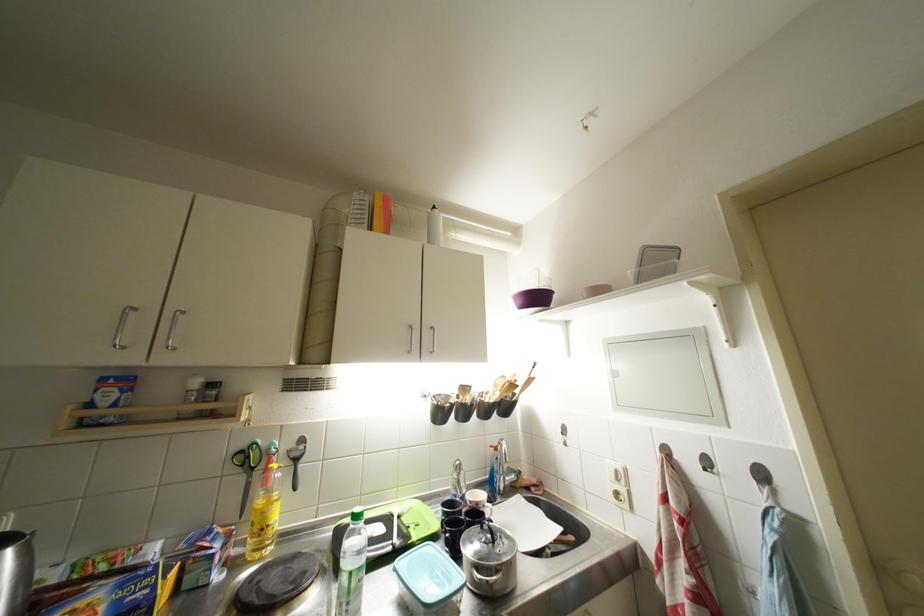
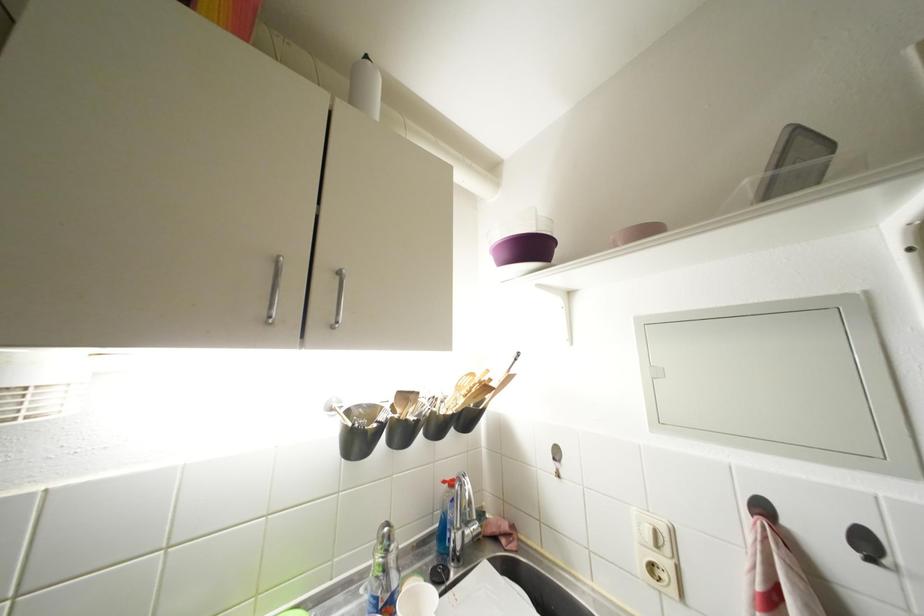
The point at (673, 455) is marked in the first image. Where is the corresponding point in the second image?

(770, 513)